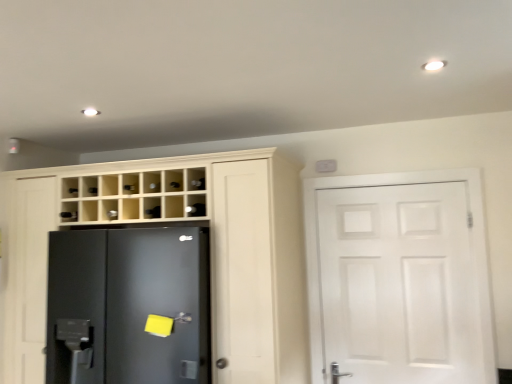
Where is `black glass shelf at upper center`? black glass shelf at upper center is located at coordinates (196, 206).

What do you see at coordinates (183, 318) in the screenshot? I see `satin nickel door handle at lower center` at bounding box center [183, 318].

What do you see at coordinates (128, 305) in the screenshot? I see `black matte refrigerator at left` at bounding box center [128, 305].

At what (x,y) coordinates should I click in order to perform the action: click on matte wood cupboard at center. Please return your answer as a coordinate pair (x, y). Looking at the image, I should click on (172, 221).

Find the location of a particular element. door above the satin nickel door handle at lower center (from the image's perspective) is located at coordinates (399, 278).

Does satin nickel door handle at lower center appear on the left side of white matte door at right?

Correct, you'll find satin nickel door handle at lower center to the left of white matte door at right.

From a real-world perspective, is satin nickel door handle at lower center below white matte door at right?

Yes, from a real-world perspective, satin nickel door handle at lower center is under white matte door at right.

Considering the sizes of objects satin nickel door handle at lower center and white matte door at right in the image provided, who is shorter, satin nickel door handle at lower center or white matte door at right?

With less height is satin nickel door handle at lower center.

From the image's perspective, is satin nickel door handle at lower center on matte wood cupboard at center?

No, from the image's perspective, satin nickel door handle at lower center is not on top of matte wood cupboard at center.

Consider the image. Are satin nickel door handle at lower center and matte wood cupboard at center located far from each other?

That's not correct — satin nickel door handle at lower center is a little close to matte wood cupboard at center.

Which object is closer to the camera taking this photo, satin nickel door handle at lower center or matte wood cupboard at center?

matte wood cupboard at center is closer to the camera.

I want to click on door handle below the matte wood cupboard at center (from the image's perspective), so click(183, 318).

Which object is thinner, matte wood cupboard at center or white matte door at right?

Thinner between the two is white matte door at right.

Does matte wood cupboard at center have a greater height compared to white matte door at right?

Indeed, matte wood cupboard at center has a greater height compared to white matte door at right.

From a real-world perspective, does matte wood cupboard at center stand above white matte door at right?

Yes.

Is the depth of matte wood cupboard at center less than that of white matte door at right?

Yes, matte wood cupboard at center is closer to the viewer.

Relative to satin nickel door handle at lower center, is black glass shelf at upper center in front or behind?

In the image, black glass shelf at upper center appears behind satin nickel door handle at lower center.

Locate an element on the screen. This screenshot has width=512, height=384. shelf to the right of satin nickel door handle at lower center is located at coordinates (196, 206).

Is there a large distance between black glass shelf at upper center and satin nickel door handle at lower center?

No, there isn't a large distance between black glass shelf at upper center and satin nickel door handle at lower center.

Is white matte door at right wider than black glass shelf at upper center?

Incorrect, the width of white matte door at right does not surpass that of black glass shelf at upper center.

Is white matte door at right further to the viewer compared to black glass shelf at upper center?

Yes, the depth of white matte door at right is greater than that of black glass shelf at upper center.

Is black glass shelf at upper center at the back of white matte door at right?

No.

What's the angular difference between satin nickel door handle at lower center and black glass shelf at upper center's facing directions?

There is a 1.11-degree angle between the facing directions of satin nickel door handle at lower center and black glass shelf at upper center.

Is satin nickel door handle at lower center taller or shorter than black glass shelf at upper center?

satin nickel door handle at lower center is shorter than black glass shelf at upper center.

Does satin nickel door handle at lower center come in front of black glass shelf at upper center?

Yes, the depth of satin nickel door handle at lower center is less than that of black glass shelf at upper center.

Consider the image. Between black matte refrigerator at left and matte wood cupboard at center, which one appears on the left side from the viewer's perspective?

From the viewer's perspective, black matte refrigerator at left appears more on the left side.

The width and height of the screenshot is (512, 384). What are the coordinates of `refrigerator on the left side of matte wood cupboard at center` in the screenshot? It's located at (128, 305).

Is black matte refrigerator at left wider or thinner than matte wood cupboard at center?

In the image, black matte refrigerator at left appears to be wider than matte wood cupboard at center.

In the scene shown: What's the angular difference between black matte refrigerator at left and matte wood cupboard at center's facing directions?

black matte refrigerator at left and matte wood cupboard at center are facing 2.13 degrees away from each other.

The height and width of the screenshot is (384, 512). In order to click on door handle in front of the white matte door at right in this screenshot , I will do `click(183, 318)`.

Locate an element on the screen. The height and width of the screenshot is (384, 512). door handle beneath the matte wood cupboard at center (from a real-world perspective) is located at coordinates (183, 318).

When comparing their distances from black glass shelf at upper center, does satin nickel door handle at lower center or black matte refrigerator at left seem further?

black matte refrigerator at left is further to black glass shelf at upper center.

Estimate the real-world distances between objects in this image. Which object is further from black glass shelf at upper center, black matte refrigerator at left or matte wood cupboard at center?

black matte refrigerator at left is positioned further to the anchor black glass shelf at upper center.

From the picture: From the image, which object appears to be nearer to white matte door at right, black matte refrigerator at left or satin nickel door handle at lower center?

black matte refrigerator at left.

When comparing their distances from satin nickel door handle at lower center, does matte wood cupboard at center or black matte refrigerator at left seem further?

Based on the image, matte wood cupboard at center appears to be further to satin nickel door handle at lower center.

Looking at the image, which one is located closer to matte wood cupboard at center, white matte door at right or satin nickel door handle at lower center?

white matte door at right.

Considering their positions, is matte wood cupboard at center positioned closer to white matte door at right than black matte refrigerator at left?

matte wood cupboard at center is closer to white matte door at right.

When comparing their distances from black glass shelf at upper center, does white matte door at right or matte wood cupboard at center seem further?

white matte door at right is further to black glass shelf at upper center.

Considering their positions, is matte wood cupboard at center positioned further to black matte refrigerator at left than satin nickel door handle at lower center?

satin nickel door handle at lower center.

Identify the location of shelf between satin nickel door handle at lower center and white matte door at right. This screenshot has width=512, height=384. (196, 206).

What are the coordinates of `door handle located between matte wood cupboard at center and white matte door at right in the left-right direction` in the screenshot? It's located at (183, 318).

This screenshot has height=384, width=512. In order to click on shelf between matte wood cupboard at center and white matte door at right from left to right in this screenshot , I will do `click(196, 206)`.

Find the location of `cupboard situated between black matte refrigerator at left and satin nickel door handle at lower center from left to right`. cupboard situated between black matte refrigerator at left and satin nickel door handle at lower center from left to right is located at coordinates (172, 221).